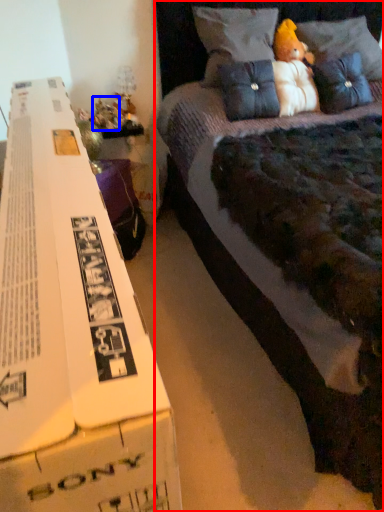
Question: Which point is closer to the camera, bed (highlighted by a red box) or toy (highlighted by a blue box)?

Choices:
 (A) bed
 (B) toy

Answer: (A)